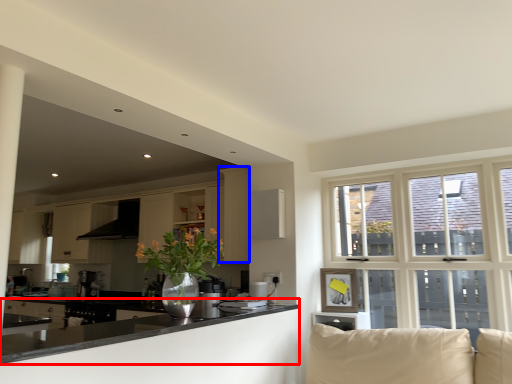
Question: Which object appears farthest to the camera in this image, countertop (highlighted by a red box) or cabinetry (highlighted by a blue box)?

Choices:
 (A) countertop
 (B) cabinetry

Answer: (B)